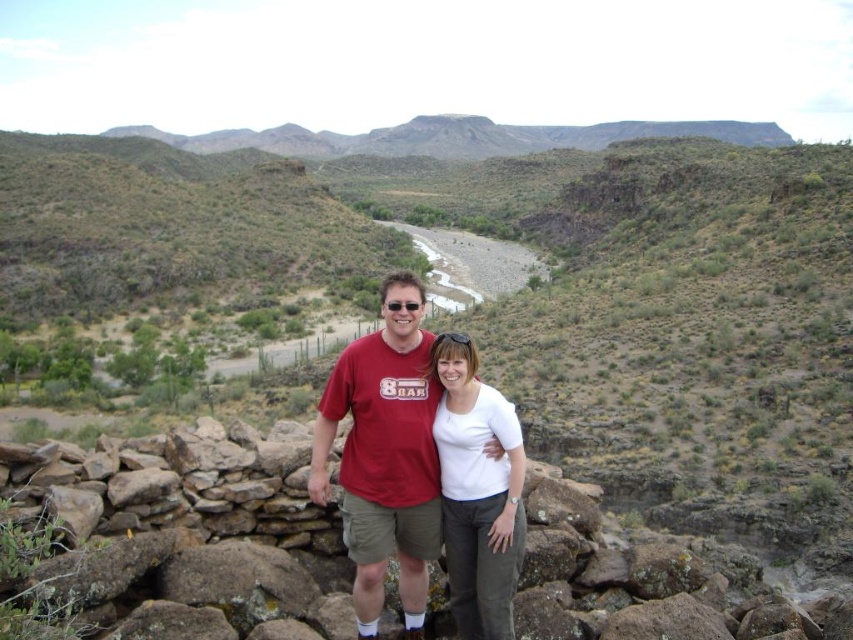
Question: Which point is closer to the camera?

Choices:
 (A) white matte shirt at center
 (B) rugged brown rock formation at upper center
 (C) brown rough stone wall at center
 (D) matte red t-shirt at center

Answer: (C)

Question: Is brown rough stone wall at center to the right of matte red t-shirt at center from the viewer's perspective?

Choices:
 (A) yes
 (B) no

Answer: (A)

Question: Which object is positioned closest to the brown rough stone wall at center?

Choices:
 (A) rugged brown rock formation at upper center
 (B) white matte shirt at center
 (C) matte red t-shirt at center

Answer: (C)

Question: Does matte red t-shirt at center have a larger size compared to rugged brown rock formation at upper center?

Choices:
 (A) no
 (B) yes

Answer: (A)

Question: Considering the relative positions of white matte shirt at center and rugged brown rock formation at upper center in the image provided, where is white matte shirt at center located with respect to rugged brown rock formation at upper center?

Choices:
 (A) below
 (B) above

Answer: (A)

Question: Which object is the farthest from the rugged brown rock formation at upper center?

Choices:
 (A) white matte shirt at center
 (B) brown rough stone wall at center

Answer: (A)